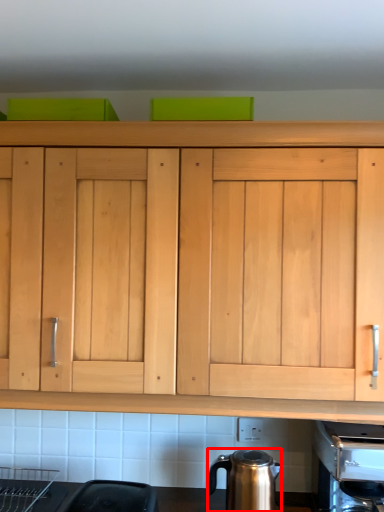
Question: Observing the image, what is the correct spatial positioning of kitchen appliance (annotated by the red box) in reference to coffee machine?

Choices:
 (A) left
 (B) right

Answer: (A)